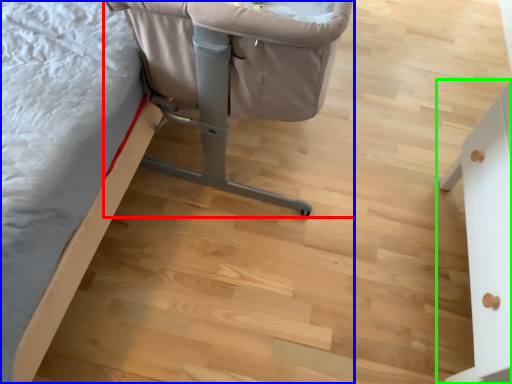
Question: Estimate the real-world distances between objects in this image. Which object is farther from furniture (highlighted by a red box), furniture (highlighted by a blue box) or furniture (highlighted by a green box)?

Choices:
 (A) furniture
 (B) furniture

Answer: (B)